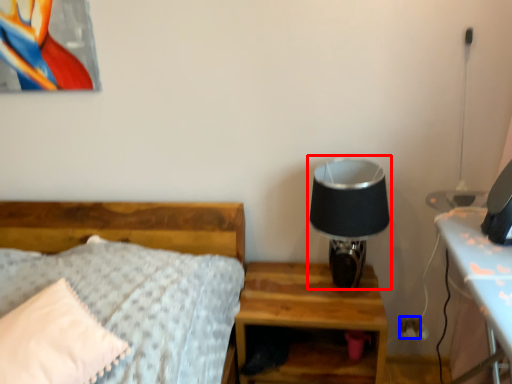
Question: Which of the following is the closest to the observer, table lamp (highlighted by a red box) or electric outlet (highlighted by a blue box)?

Choices:
 (A) table lamp
 (B) electric outlet

Answer: (A)